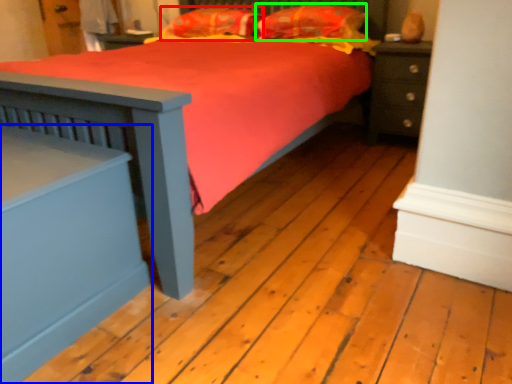
Question: Which object is positioned closest to pillow (highlighted by a red box)? Select from nightstand (highlighted by a blue box) and pillow (highlighted by a green box).

Choices:
 (A) nightstand
 (B) pillow

Answer: (B)